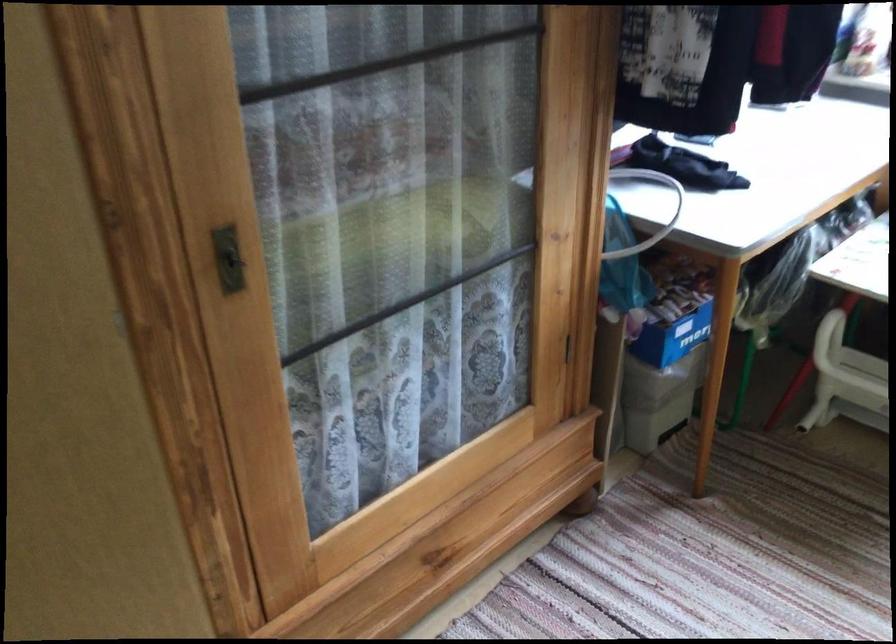
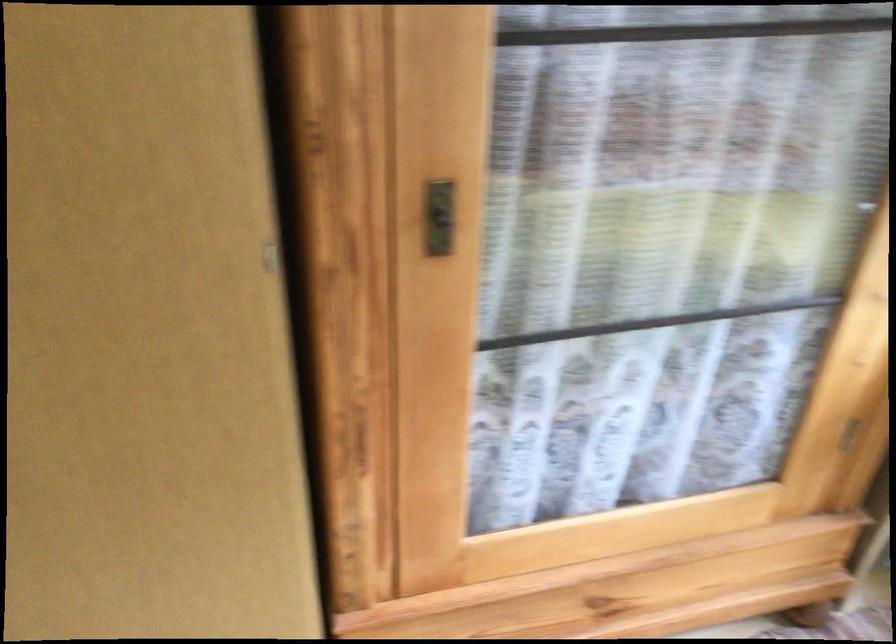
Question: How did the camera likely rotate?

Choices:
 (A) Left
 (B) Right
 (C) Up
 (D) Down

Answer: (A)